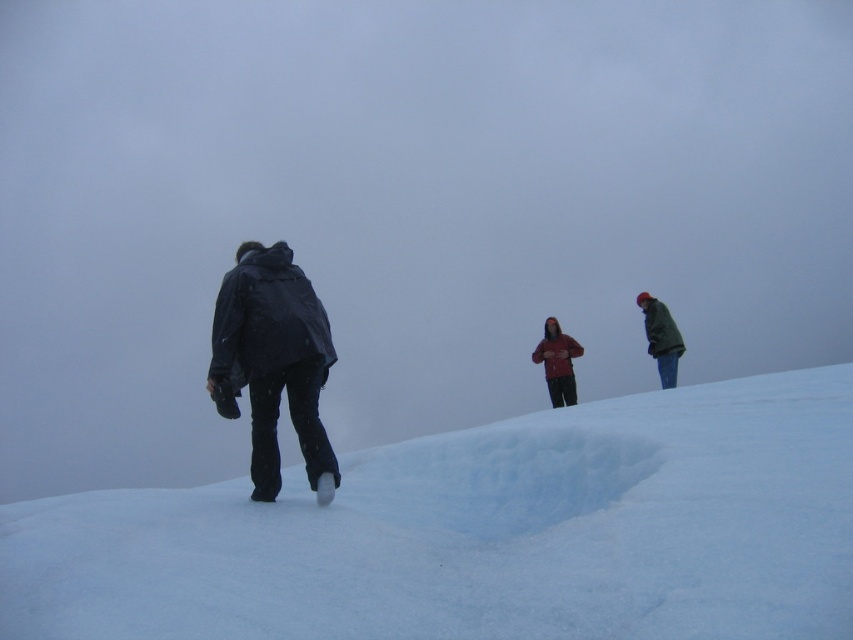
You are a photographer trying to capture a shot of the matte red jacket at center from the white fluffy snow at center. Based on the distance between them, will you need a telephoto lens to ensure the jacket is in focus and fills the frame adequately?

The white fluffy snow at center and matte red jacket at center are 31.57 feet apart. To ensure the matte red jacket at center is in focus and fills the frame adequately from that distance, a telephoto lens would be necessary.

You are planning to take a photo of the white fluffy snow at center and the matte red jacket at center. Based on their positions, which object should you focus on first to ensure both are in sharp focus?

The white fluffy snow at center is located below the matte red jacket at center. To ensure both are in sharp focus, you should focus on the matte red jacket at center first since it is farther away from the camera compared to the white fluffy snow at center.